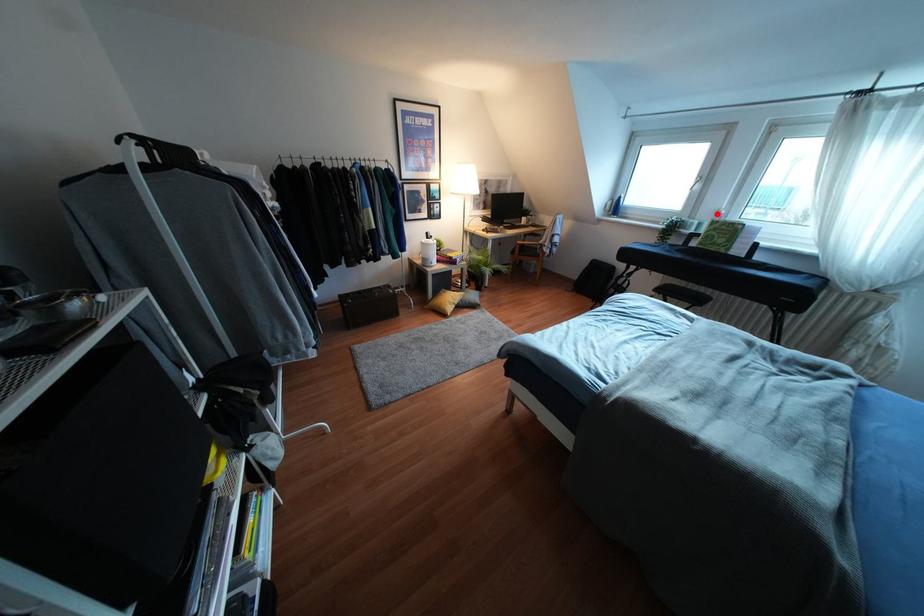
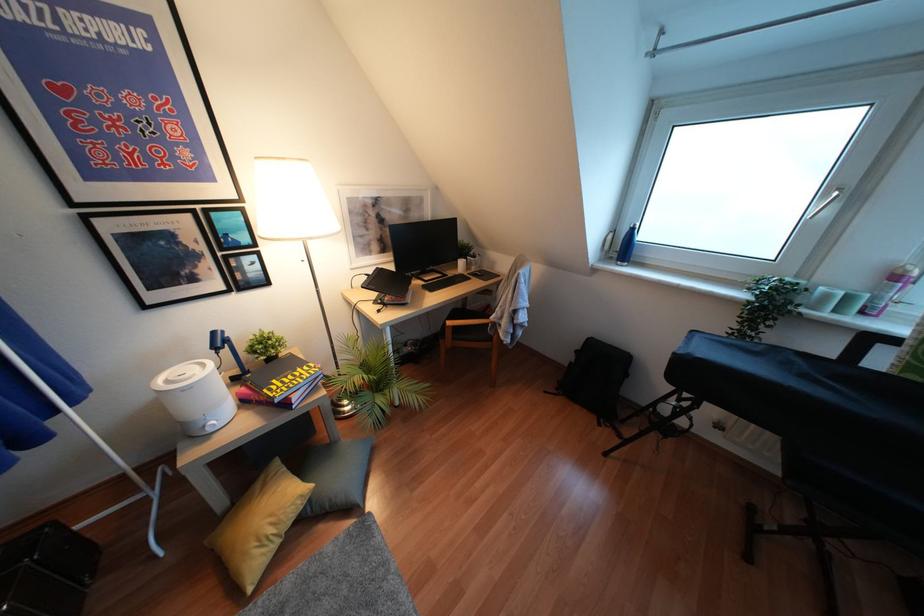
In the second image, find the point that corresponds to the highlighted location in the first image.

(895, 277)